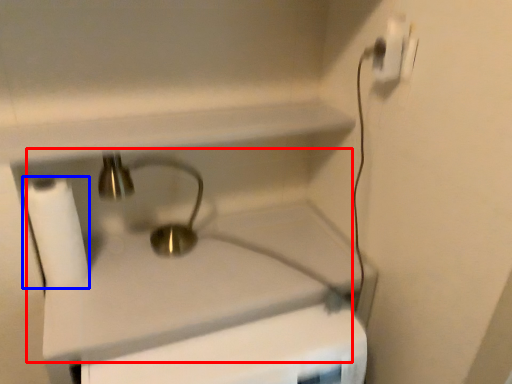
Question: Among these objects, which one is farthest to the camera, sink (highlighted by a red box) or toilet paper (highlighted by a blue box)?

Choices:
 (A) sink
 (B) toilet paper

Answer: (B)